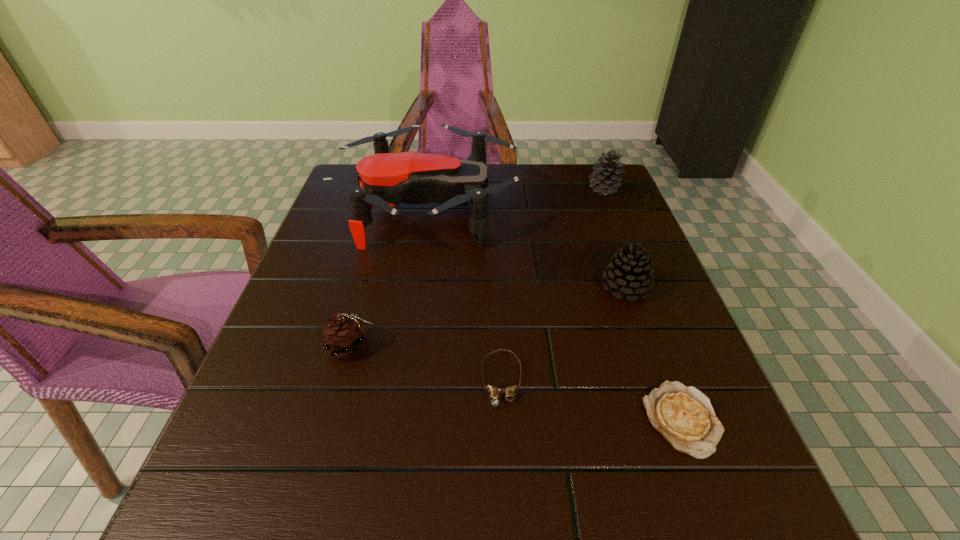
Locate an element on the screen. The height and width of the screenshot is (540, 960). blank area in the image that satisfies the following two spatial constraints: 1. at the narrow end of the third farthest object; 2. with a leaf charm attached to the shortest pinecone is located at coordinates (646, 347).

Locate an element on the screen. blank area in the image that satisfies the following two spatial constraints: 1. on the camera side of the drone; 2. on the left side of the quiche is located at coordinates (396, 419).